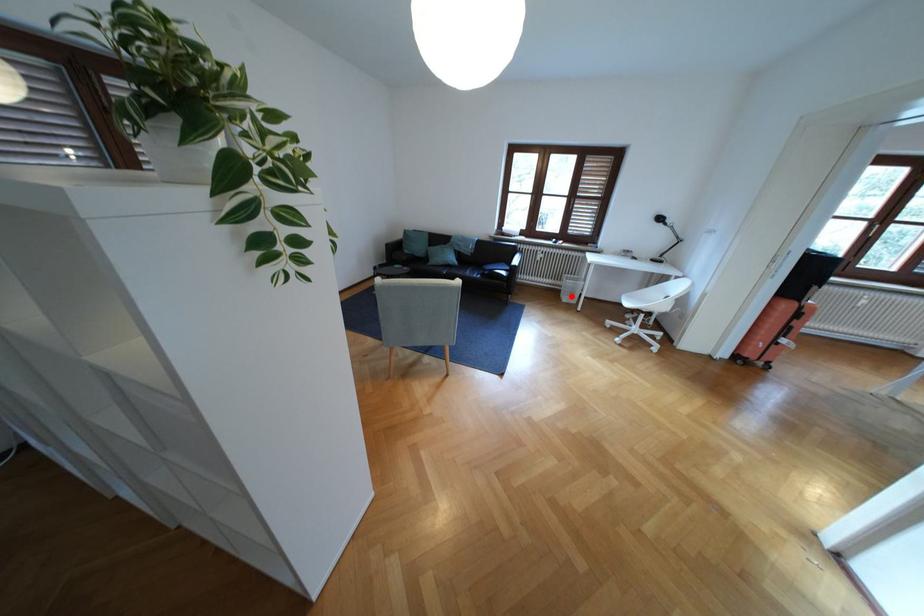
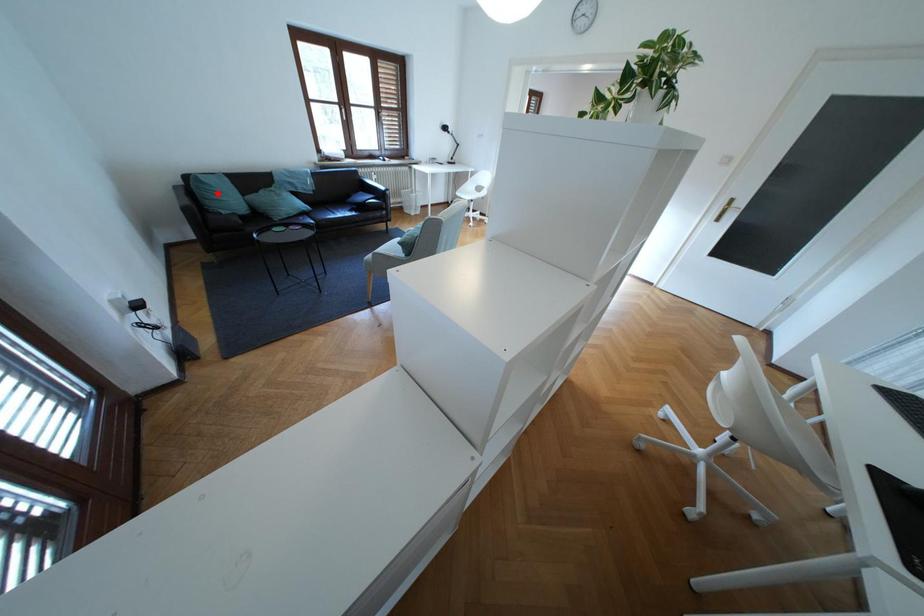
I am providing you with two images of the same scene from different viewpoints. A red point is marked on the first image and another point is marked on the second image. Is the red point in image1 aligned with the point shown in image2?

No